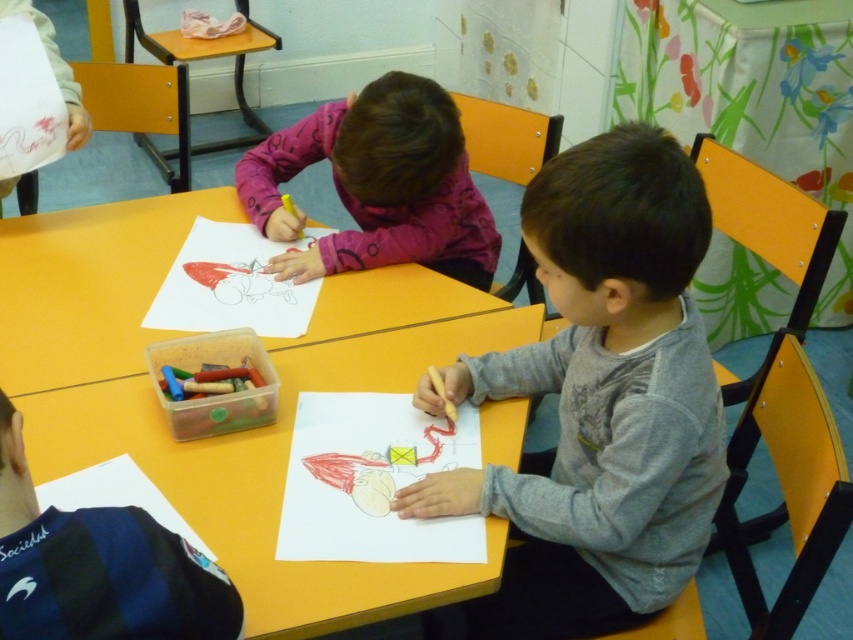
You are a teacher in the classroom and want to place a new art kit between the yellow plastic table at center and the wooden crayon at center. Based on their positions, which object should the art kit be closer to?

The yellow plastic table at center is positioned on the left side of wooden crayon at center, so the art kit should be placed closer to the yellow plastic table at center to be between them.

You are a teacher observing the classroom. You need to place a new art kit on the surface that is closer to the students. Which surface should you choose between the yellow matte table at center and the colored paper at center?

The yellow matte table at center is in front of the colored paper at center, so it is closer to the students. Therefore, you should place the new art kit on the yellow matte table at center.